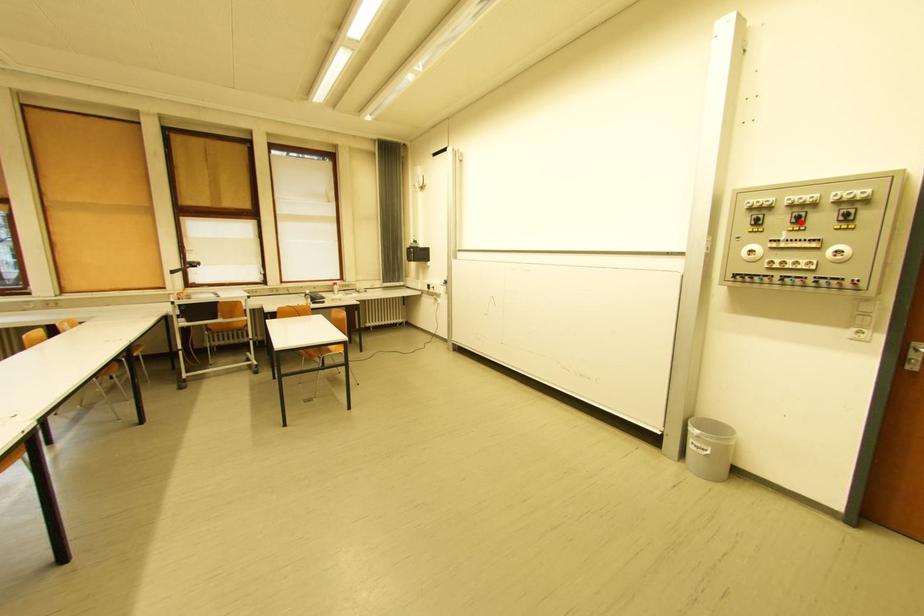
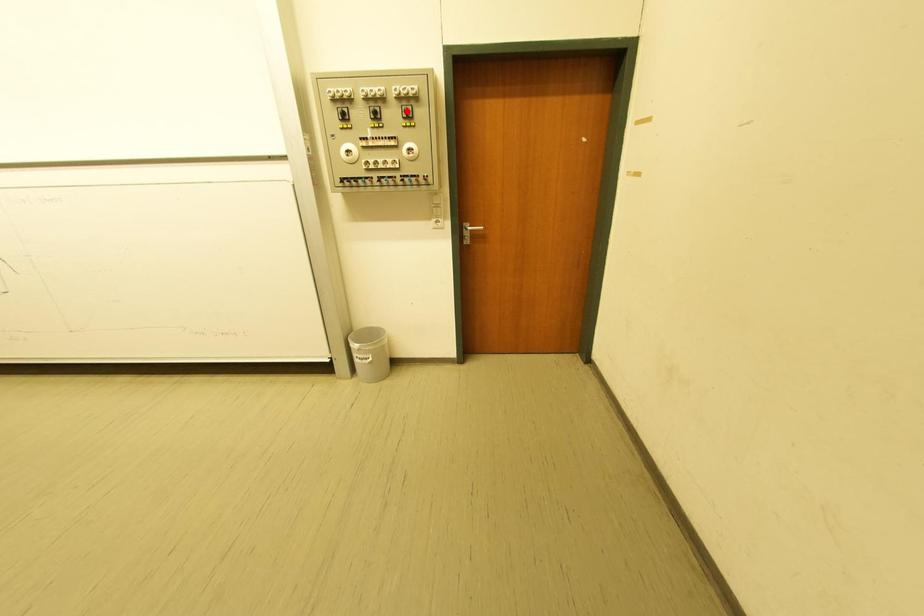
Based on the photo, I am providing you with two images of the same scene from different viewpoints. A red point is marked on the first image and another point is marked on the second image. Is the red point in image1 aligned with the point shown in image2?

No